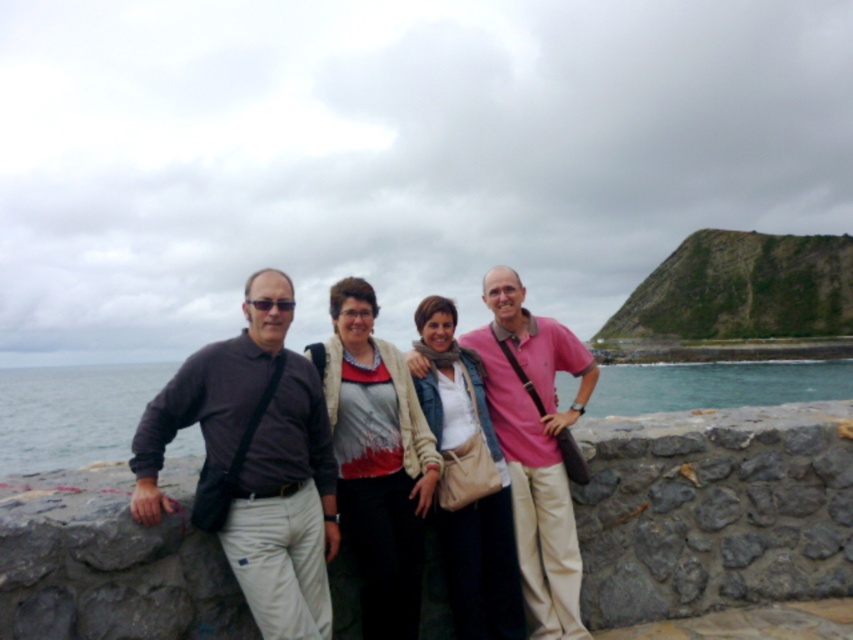
You are a photographer trying to capture a group photo of the dark gray shirt at center and the matte red sweater at center. Since you want to ensure both subjects are in focus, you need to know which one is larger. Can you tell me which one is bigger?

The dark gray shirt at center is bigger than the matte red sweater at center, so the photographer should focus on the larger one to ensure both are in focus.

You are a photographer trying to position a matte red sweater at center in the image. According to the scene description, where exactly should you place it?

The matte red sweater at center should be placed at point 0.720 on the x axis and 0.443 on the y axis as specified in the description.